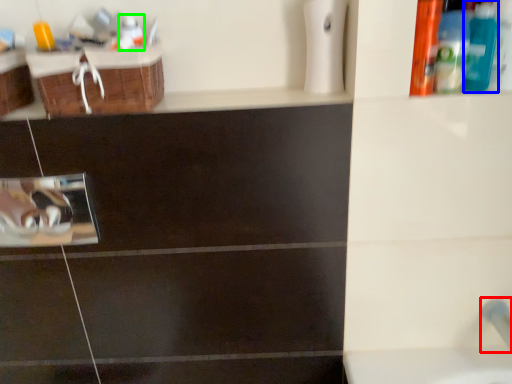
Question: Which object is positioned farthest from plumbing fixture (highlighted by a red box)? Select from mouthwash (highlighted by a blue box) and mouthwash (highlighted by a green box).

Choices:
 (A) mouthwash
 (B) mouthwash

Answer: (B)